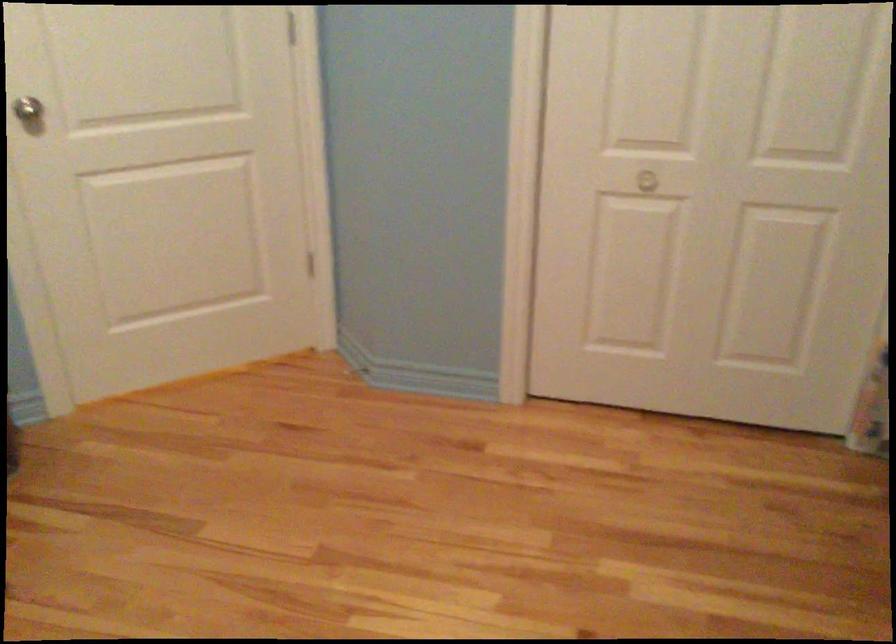
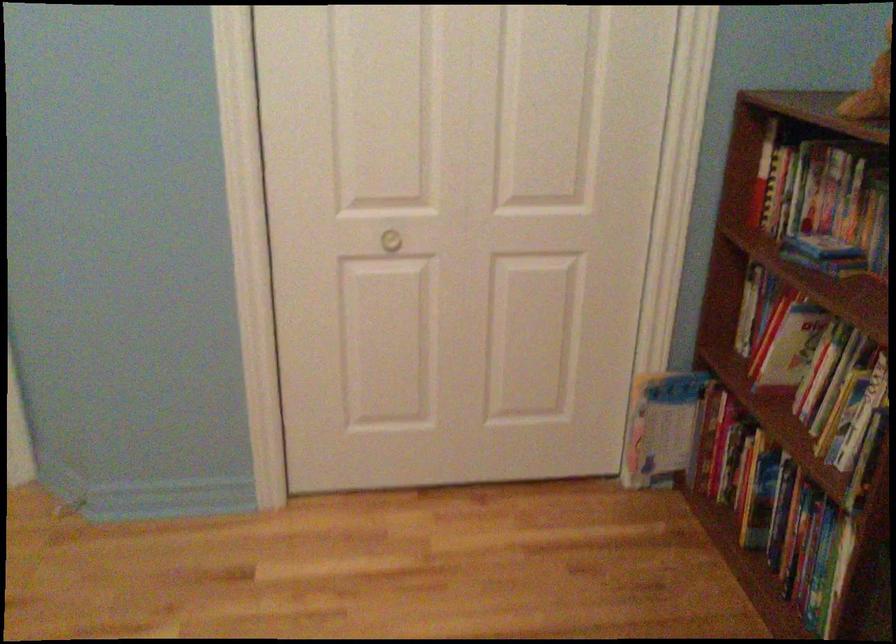
Question: Based on the continuous images, in which direction is the camera rotating? Reply with the corresponding letter.

Choices:
 (A) Left
 (B) Right
 (C) Up
 (D) Down

Answer: (B)